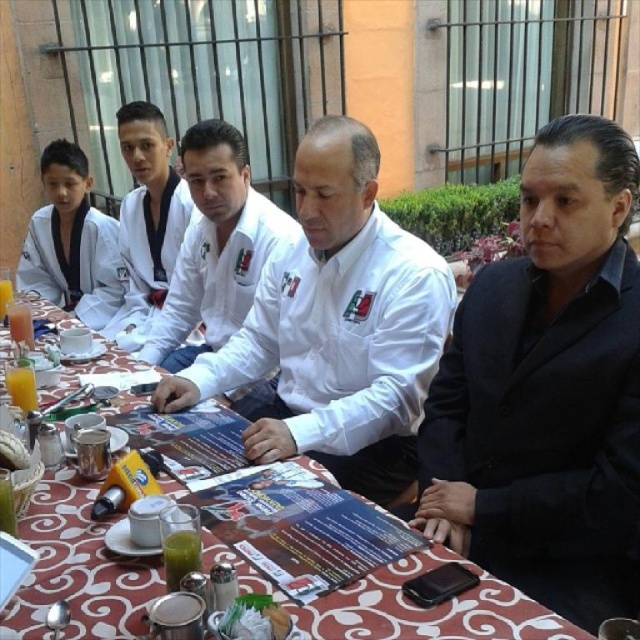
Based on the scene description, where is the white matte shirt at center located in terms of its 2D coordinates?

The white matte shirt at center is located at the 2D coordinates of point [337,326].